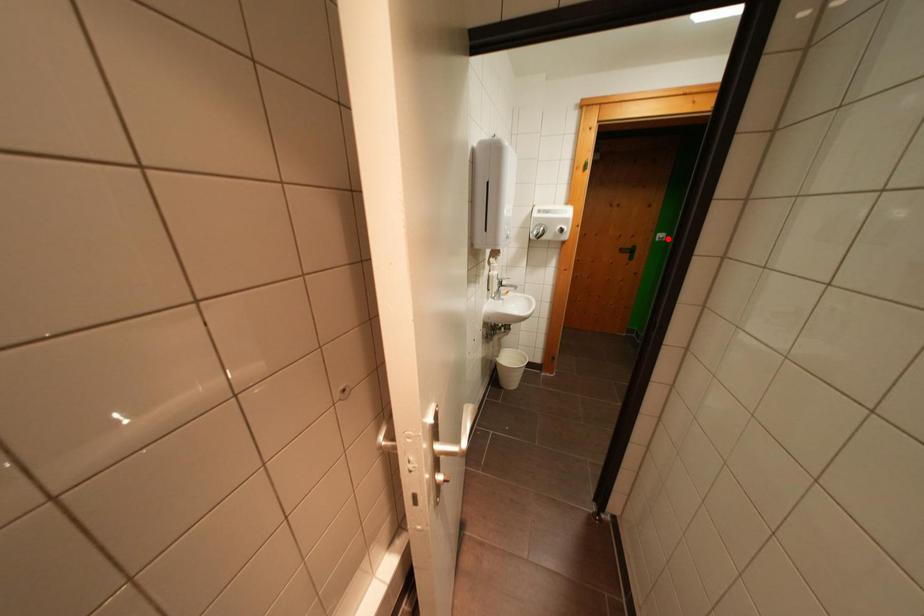
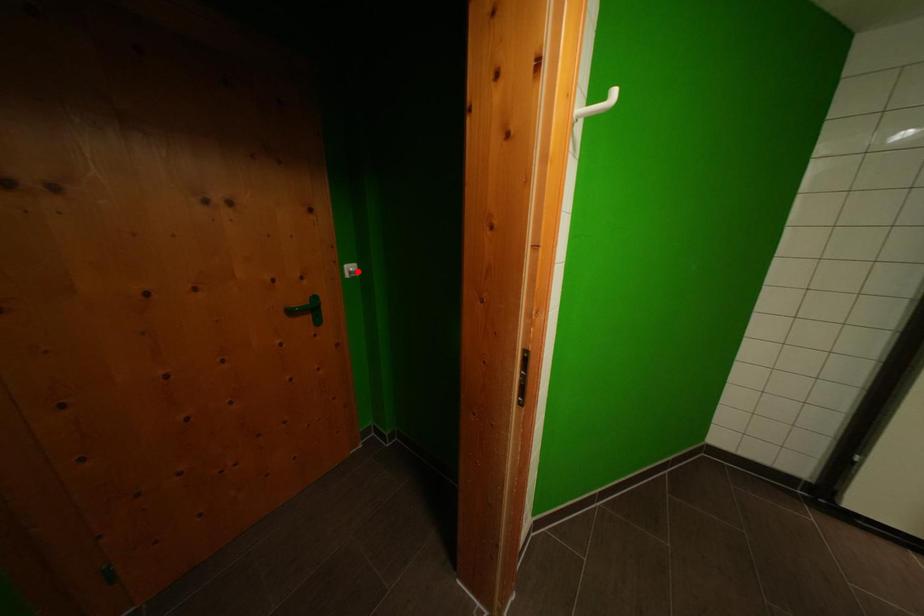
I am providing you with two images of the same scene from different viewpoints. A red point is marked on the first image and another point is marked on the second image. Do the highlighted points in image1 and image2 indicate the same real-world spot?

Yes